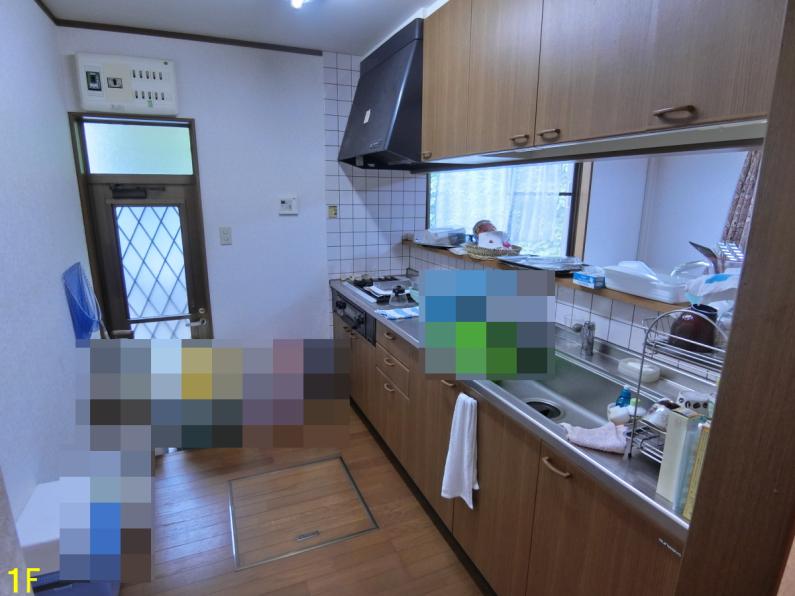
The height and width of the screenshot is (596, 795). Identify the location of trap door. click(x=282, y=512).